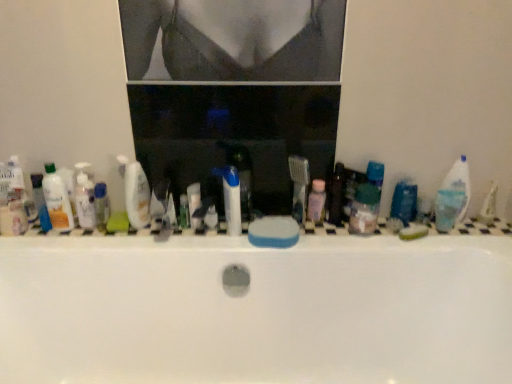
Question: From a real-world perspective, is translucent plastic bottle at left, which ranks as the 4th toiletry in right-to-left order, positioned under pink translucent bottle at center, arranged as the 1th toiletry when viewed from the right, based on gravity?

Choices:
 (A) no
 (B) yes

Answer: (A)

Question: Is the position of translucent plastic bottle at left, which ranks as the 4th toiletry in right-to-left order, less distant than that of pink translucent bottle at center, the 4th toiletry positioned from the left?

Choices:
 (A) yes
 (B) no

Answer: (A)

Question: Considering the relative positions of translucent plastic bottle at left, which ranks as the 4th toiletry in right-to-left order, and pink translucent bottle at center, the 4th toiletry positioned from the left, in the image provided, is translucent plastic bottle at left, which ranks as the 4th toiletry in right-to-left order, to the right of pink translucent bottle at center, the 4th toiletry positioned from the left, from the viewer's perspective?

Choices:
 (A) no
 (B) yes

Answer: (A)

Question: Can you confirm if translucent plastic bottle at left, which ranks as the 4th toiletry in right-to-left order, is wider than pink translucent bottle at center, arranged as the 1th toiletry when viewed from the right?

Choices:
 (A) no
 (B) yes

Answer: (B)

Question: Considering the relative sizes of translucent plastic bottle at left, marked as the 1th toiletry in a left-to-right arrangement, and pink translucent bottle at center, the 4th toiletry positioned from the left, in the image provided, is translucent plastic bottle at left, marked as the 1th toiletry in a left-to-right arrangement, bigger than pink translucent bottle at center, the 4th toiletry positioned from the left,?

Choices:
 (A) yes
 (B) no

Answer: (A)

Question: Would you say translucent plastic bottle at left, which ranks as the 4th toiletry in right-to-left order, is to the left or to the right of translucent plastic mouthwash at left, positioned as the 1th mouthwash in left-to-right order, in the picture?

Choices:
 (A) left
 (B) right

Answer: (A)

Question: In terms of width, does translucent plastic bottle at left, marked as the 1th toiletry in a left-to-right arrangement, look wider or thinner when compared to translucent plastic mouthwash at left, positioned as the 1th mouthwash in left-to-right order?

Choices:
 (A) wide
 (B) thin

Answer: (B)

Question: In terms of height, does translucent plastic bottle at left, marked as the 1th toiletry in a left-to-right arrangement, look taller or shorter compared to translucent plastic mouthwash at left, positioned as the 1th mouthwash in left-to-right order?

Choices:
 (A) tall
 (B) short

Answer: (B)

Question: In terms of size, does translucent plastic bottle at left, marked as the 1th toiletry in a left-to-right arrangement, appear bigger or smaller than translucent plastic mouthwash at left, the 3th mouthwash when ordered from right to left?

Choices:
 (A) small
 (B) big

Answer: (A)

Question: Do you think translucent plastic mouthwash at left, the 2th mouthwash from the left, is within translucent plastic bottle at left, the 2th toiletry when ordered from left to right, or outside of it?

Choices:
 (A) inside
 (B) outside

Answer: (B)

Question: From the image's perspective, is translucent plastic mouthwash at left, the 2th mouthwash from the left, located above or below translucent plastic bottle at left, which ranks as the 3th toiletry in right-to-left order?

Choices:
 (A) above
 (B) below

Answer: (A)

Question: In terms of width, does translucent plastic mouthwash at left, the 2th mouthwash from the left, look wider or thinner when compared to translucent plastic bottle at left, the 2th toiletry when ordered from left to right?

Choices:
 (A) thin
 (B) wide

Answer: (B)

Question: From a real-world perspective, is translucent plastic mouthwash at left, placed as the 2th mouthwash when sorted from right to left, physically located above or below translucent plastic bottle at left, the 2th toiletry when ordered from left to right?

Choices:
 (A) above
 (B) below

Answer: (A)

Question: Based on their positions, is pink translucent bottle at center, arranged as the 1th toiletry when viewed from the right, located to the left or right of translucent plastic mouthwash at left, the 3th mouthwash when ordered from right to left?

Choices:
 (A) left
 (B) right

Answer: (B)

Question: From the image's perspective, is pink translucent bottle at center, the 4th toiletry positioned from the left, located above or below translucent plastic mouthwash at left, the 3th mouthwash when ordered from right to left?

Choices:
 (A) below
 (B) above

Answer: (A)